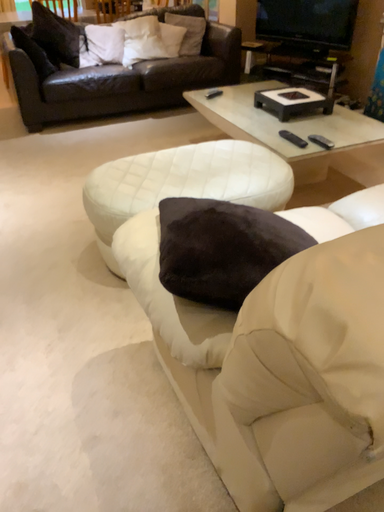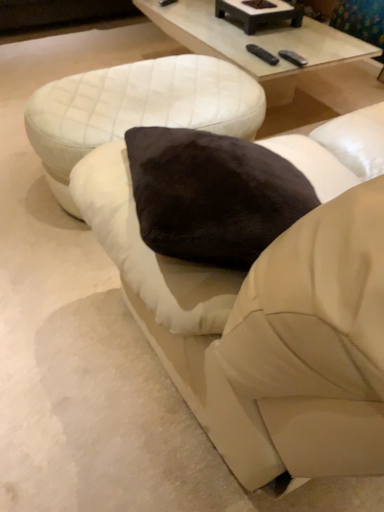
Question: How did the camera likely rotate when shooting the video?

Choices:
 (A) rotated downward
 (B) rotated upward

Answer: (A)